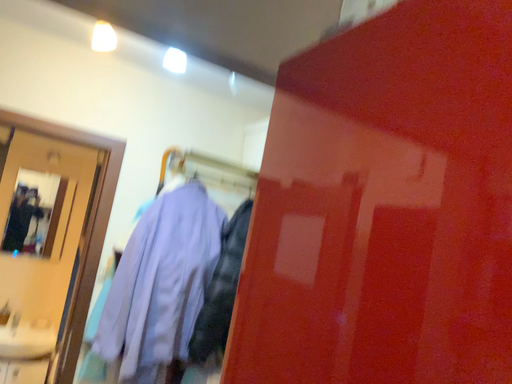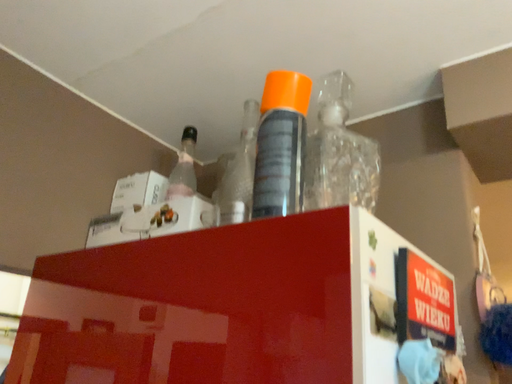
Question: Which way did the camera rotate in the video?

Choices:
 (A) rotated downward
 (B) rotated upward

Answer: (B)